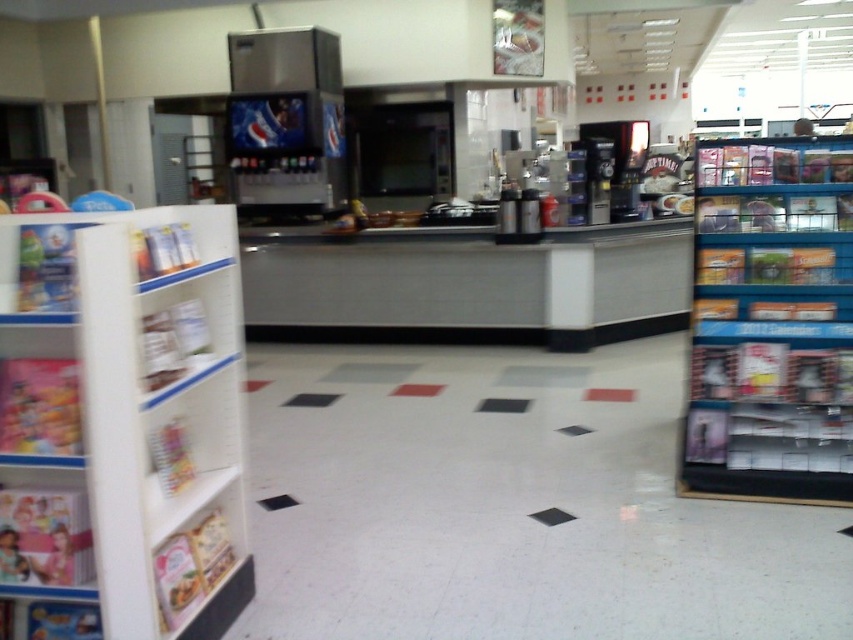
You are a customer in the store and want to grab an item from both the white cardboard shelf at left and the blue plastic shelves at right. Which shelf should you approach first to reach the one closer to you?

You should approach the white cardboard shelf at left first because it is closer to you than the blue plastic shelves at right, which are further away.

Consider the image. You are a customer in the store and want to reach an item on the white cardboard shelf at left and the blue plastic shelves at right. Which shelf will require you to use a step stool to reach the item?

The blue plastic shelves at right require a step stool because they are taller than the white cardboard shelf at left.

Consider the image. You are a delivery person who needs to place a large box between the white cardboard shelf at left and the blue plastic shelves at right. The box requires 2 meters of space. Is there enough space between them?

The white cardboard shelf at left is 2.27 meters away from the blue plastic shelves at right, so yes, there is enough space to place the large box between them since the distance exceeds the required 2 meters.